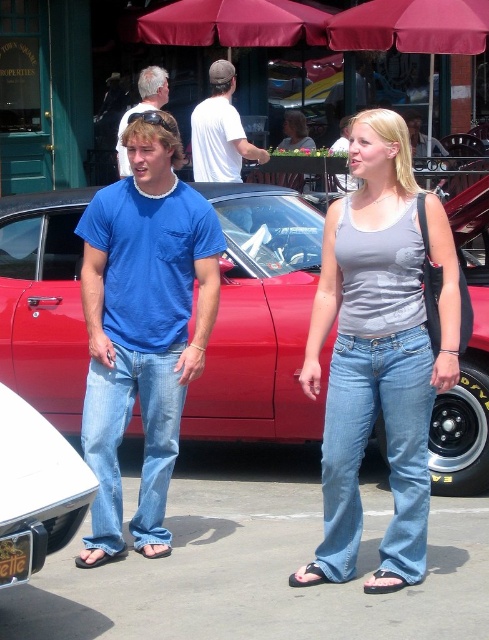
You are a photographer at the car show and want to take a photo of the shiny red car at center without any people in the frame. Based on their positions, can you position yourself so that the denim jeans at center is not visible in the shot?

The denim jeans at center is behind the shiny red car at center, so if you position yourself so the car is between you and the denim jeans at center, the jeans will be hidden behind the car, allowing you to take a clear photo of the shiny red car at center without any people visible.

You are a photographer trying to capture the shiny red car at center and the metallic silver bumper at lower left in a single frame. Given that the camera can only focus on objects within a 1.5 meter height range, will both objects be in focus?

The shiny red car at center is much taller than the metallic silver bumper at lower left. Since the camera can only focus on objects within a 1.5 meter height range, if the height difference between them exceeds 1.5 meters, they won